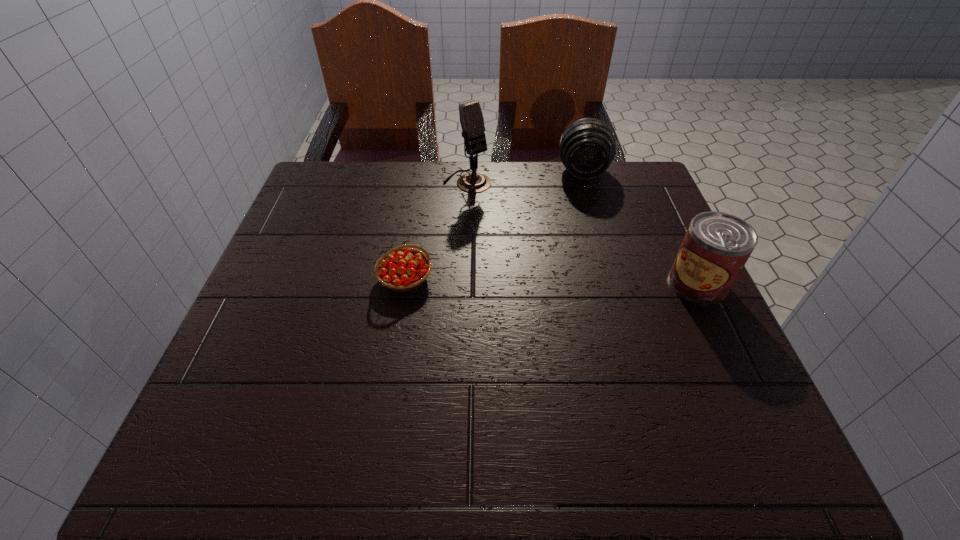
This screenshot has height=540, width=960. I want to click on vacant space on the desktop that is between the strawberry and the can and is positioned on the front-facing side of the third object from right to left, so click(576, 281).

Where is `vacant space on the desktop that is between the strawberry and the can and is positioned at the front element of the telephoto lens`? The image size is (960, 540). vacant space on the desktop that is between the strawberry and the can and is positioned at the front element of the telephoto lens is located at coordinates (587, 282).